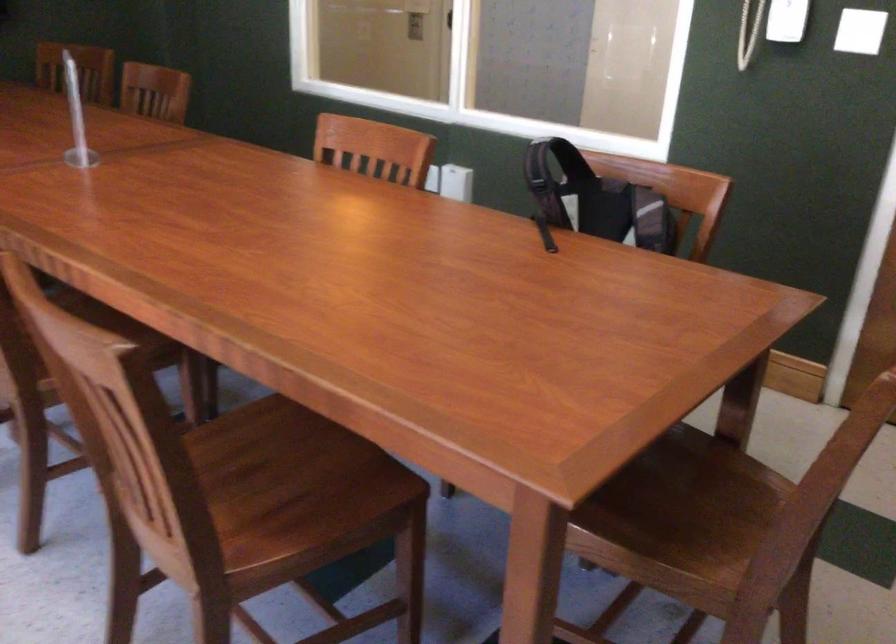
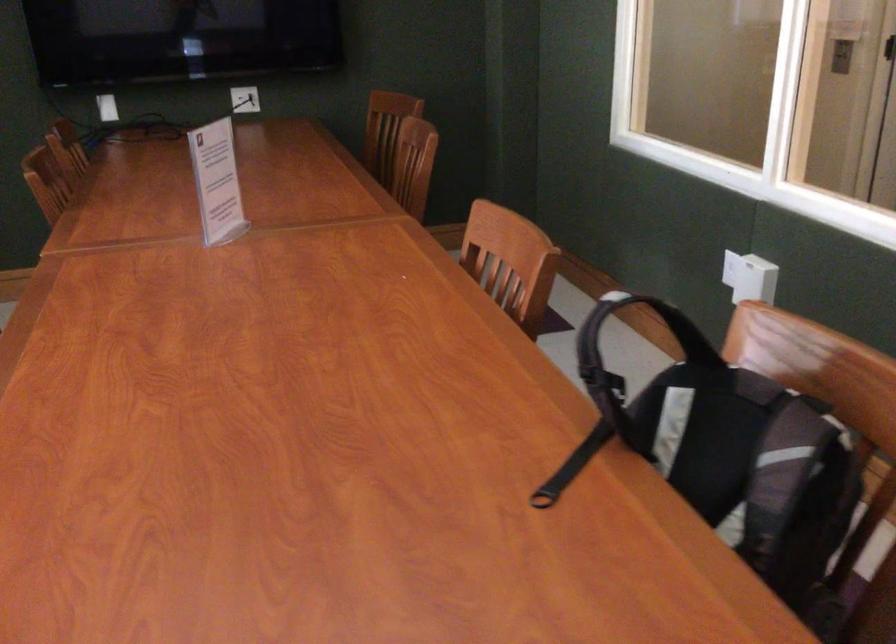
Where in the second image is the point corresponding to the point at 573,161 from the first image?

(690, 337)